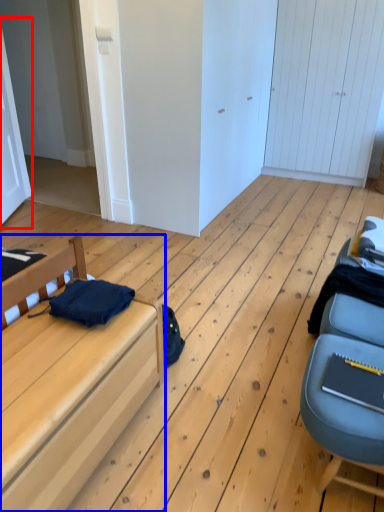
Question: Which object is further to the camera taking this photo, door (highlighted by a red box) or furniture (highlighted by a blue box)?

Choices:
 (A) door
 (B) furniture

Answer: (A)